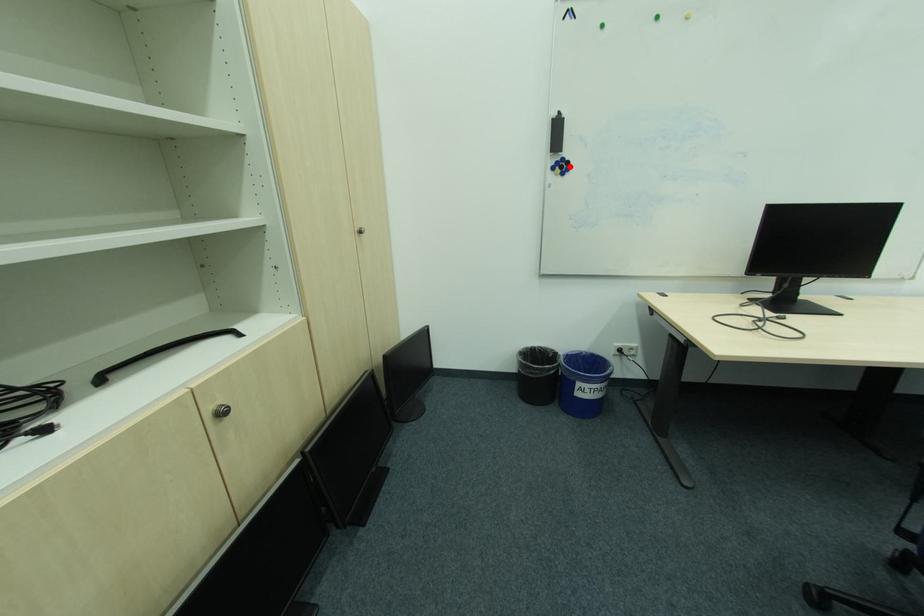
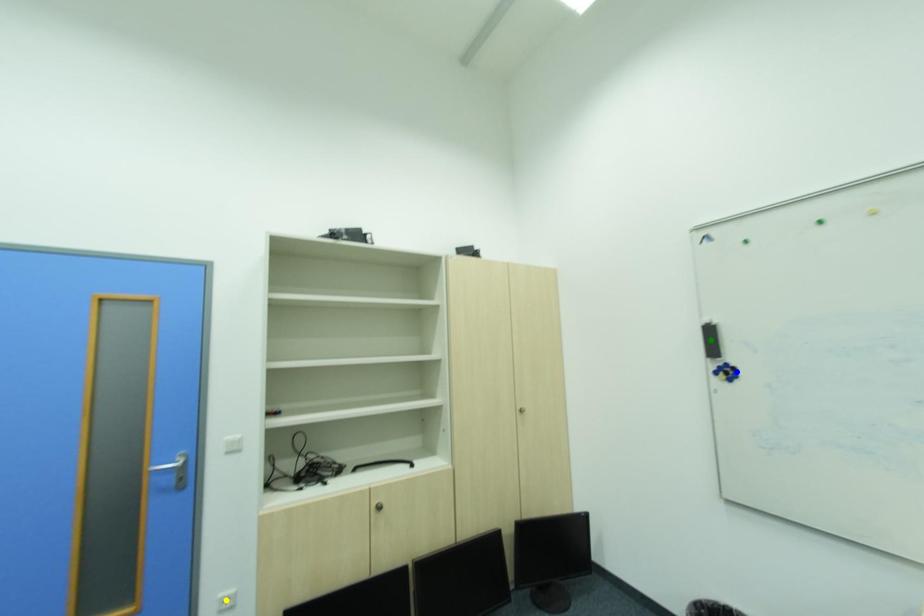
Question: I am providing you with two images of the same scene from different viewpoints. A red point is marked on the first image. You are given multiple points on the second image. Which point in image 2 represents the same 3d spot as the red point in image 1?

Choices:
 (A) green point
 (B) blue point
 (C) yellow point

Answer: (B)